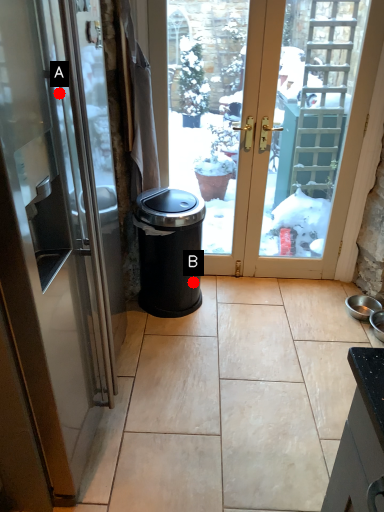
Question: Two points are circled on the image, labeled by A and B beside each circle. Which point appears farthest from the camera in this image?

Choices:
 (A) A is further
 (B) B is further

Answer: (B)